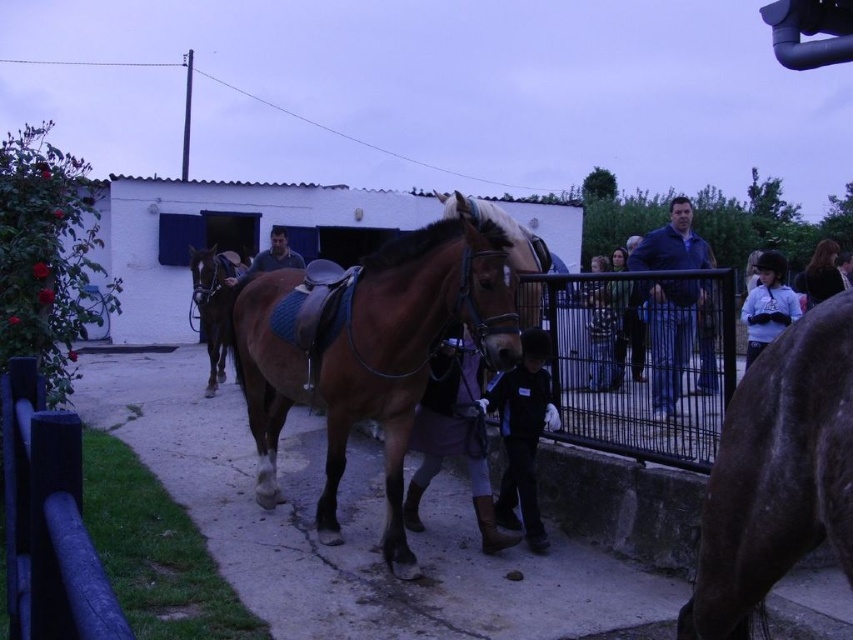
Question: Is dark brown leather boots at center to the left of blue denim jacket at upper right from the viewer's perspective?

Choices:
 (A) no
 (B) yes

Answer: (B)

Question: Which of the following is the closest to the observer?

Choices:
 (A) (837, 268)
 (B) (525, 358)
 (C) (563, 404)

Answer: (B)

Question: Which is nearer to the brown glossy horse at center?

Choices:
 (A) white matte helmet at upper right
 (B) brown glossy horse at right

Answer: (A)

Question: Does brown glossy saddle at center come in front of dark blue jeans at center?

Choices:
 (A) yes
 (B) no

Answer: (A)

Question: Which object appears farthest from the camera in this image?

Choices:
 (A) metallic wire fence at center
 (B) brown glossy horse at center

Answer: (B)

Question: Where is white matte helmet at upper right located in relation to dark brown hair at upper right in the image?

Choices:
 (A) above
 (B) below

Answer: (B)